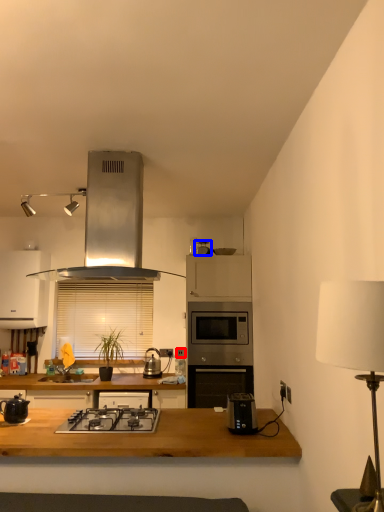
Question: Which of the following is the closest to the observer, electric outlet (highlighted by a red box) or appliance (highlighted by a blue box)?

Choices:
 (A) electric outlet
 (B) appliance

Answer: (B)